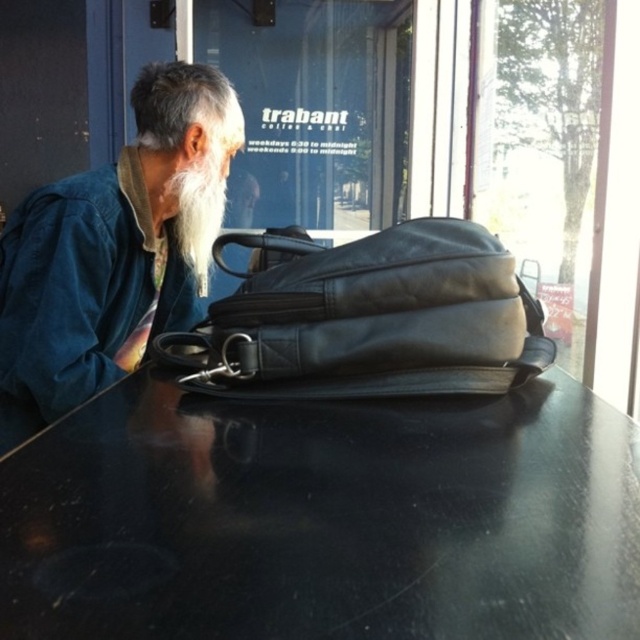
You are standing in the cafe and want to move from point A to point B. The points are labeled as point (163, 557) and point (188, 195). Which point is closer to you when facing the cafe entrance?

Point (163, 557) is in front of point (188, 195), so when facing the cafe entrance, point (163, 557) is closer to you.